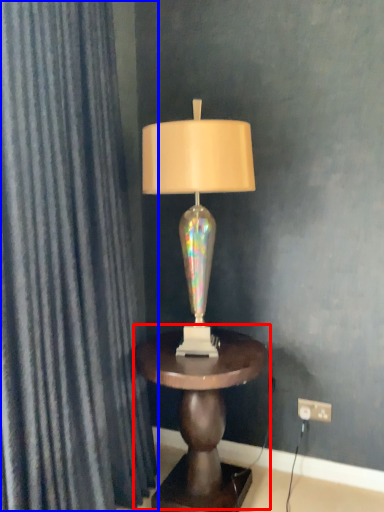
Question: Which object is further to the camera taking this photo, table (highlighted by a red box) or curtain (highlighted by a blue box)?

Choices:
 (A) table
 (B) curtain

Answer: (A)